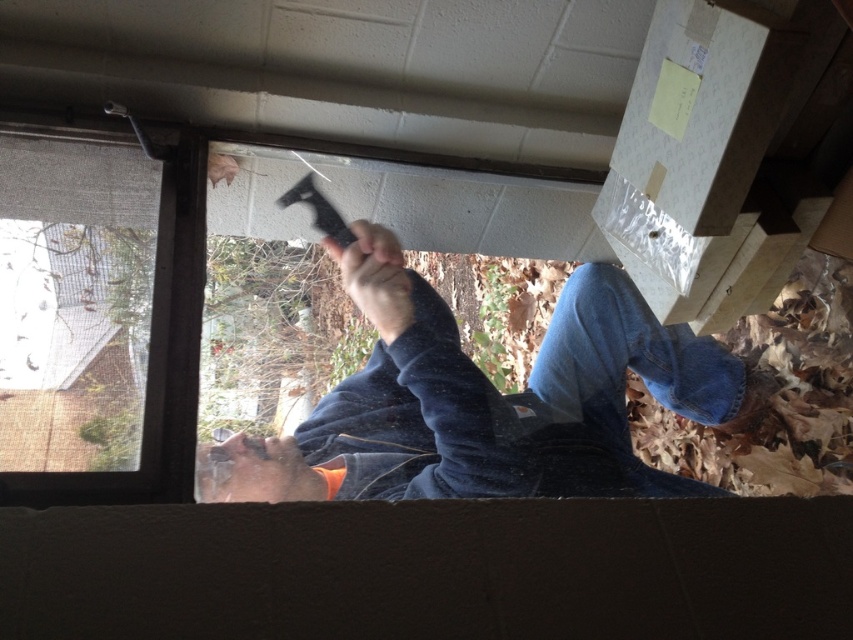
Who is higher up, dark blue fleece at center or orange fabric hand at lower center?

Positioned higher is dark blue fleece at center.

Is dark blue fleece at center smaller than orange fabric hand at lower center?

No, dark blue fleece at center is not smaller than orange fabric hand at lower center.

In order to click on dark blue fleece at center in this screenshot , I will do `click(485, 401)`.

Is clear glass window at center in front of dark blue fleece at center?

That is True.

Between clear glass window at center and dark blue fleece at center, which one appears on the left side from the viewer's perspective?

Positioned to the left is clear glass window at center.

Is point (535, 184) less distant than point (386, 381)?

No, it is behind (386, 381).

The width and height of the screenshot is (853, 640). What are the coordinates of `clear glass window at center` in the screenshot? It's located at (119, 305).

Which is in front, point (216, 492) or point (390, 257)?

Point (216, 492) is more forward.

Which is below, orange fabric hand at lower center or matte black tool at center?

orange fabric hand at lower center is below.

The image size is (853, 640). In order to click on orange fabric hand at lower center in this screenshot , I will do `click(254, 472)`.